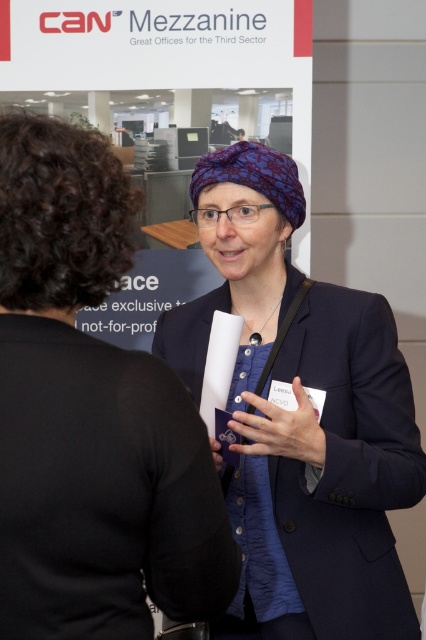
You are an event photographer at the conference. You need to capture a clear photo of both the blue textured scarf at center and the blue fabric headscarf at center. Which one is positioned higher in the frame?

The blue textured scarf at center is positioned higher in the frame than the blue fabric headscarf at center.

You are standing at the center of the conference room and see two points in the image. The first point is at coordinate point (80, 541) and the second point is at coordinate point (222, 195). Which point is closer to you?

Point (80, 541) is closer to the camera than point (222, 195).

You are organizing a photo shoot and need to ensure that all clothing items are visible in the frame. Given the scene described, which clothing item between the blue textured scarf at center and the blue fabric headscarf at center would require more careful framing to ensure it is fully captured?

The blue fabric headscarf at center requires more careful framing because it occupies more space than the blue textured scarf at center, making it potentially larger and thus needing more attention to ensure it is fully visible in the frame.